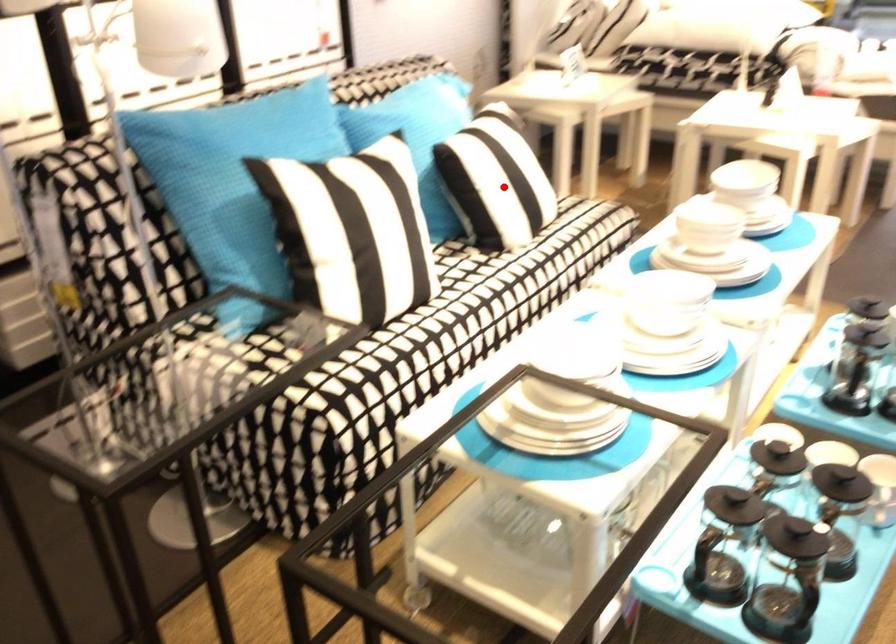
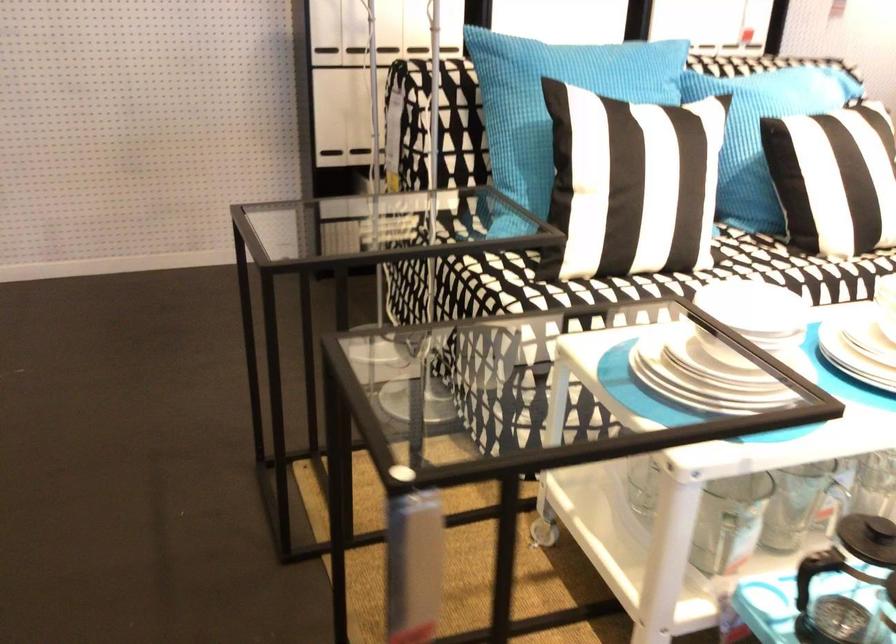
Locate, in the second image, the point that corresponds to the highlighted location in the first image.

(833, 178)